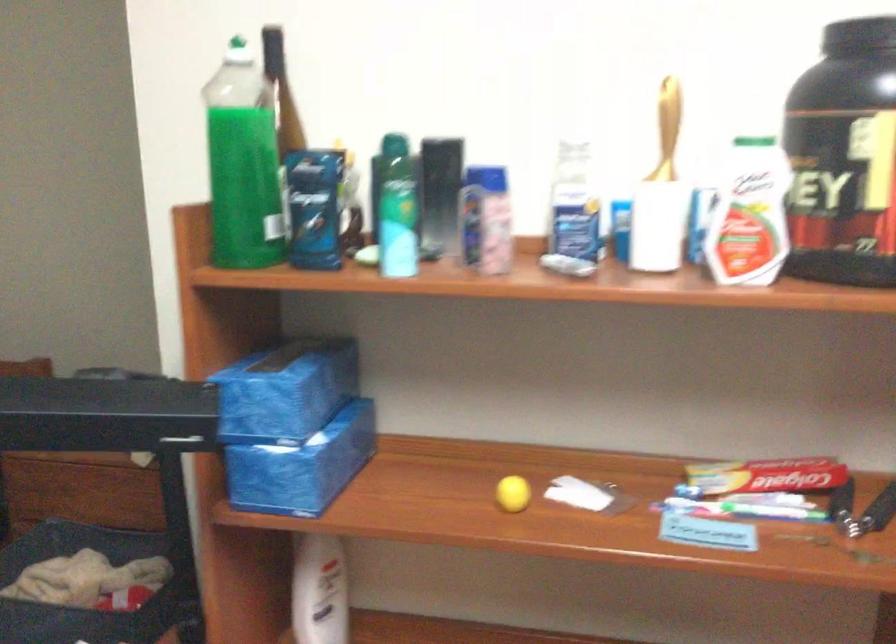
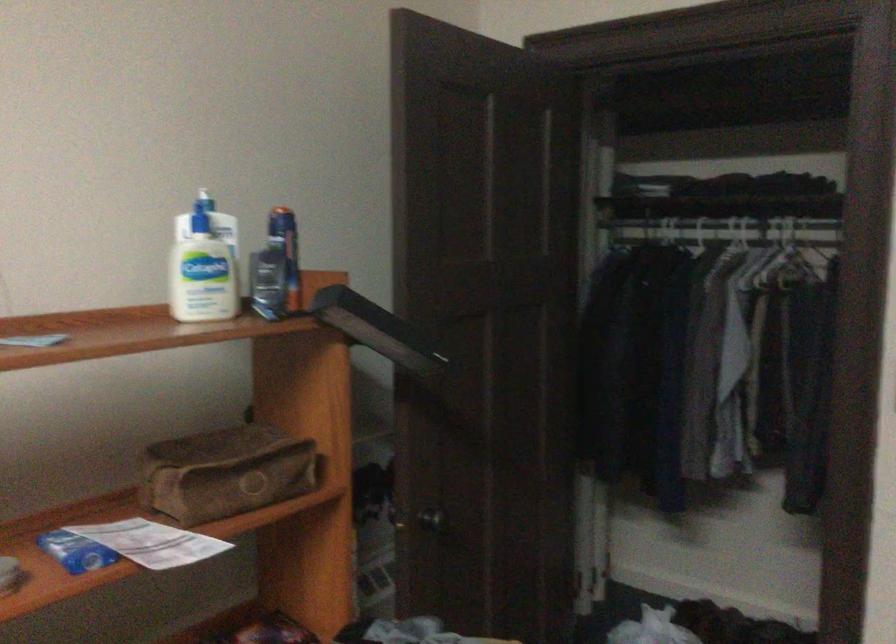
Question: The camera is either moving clockwise (left) or counter-clockwise (right) around the object. The first image is from the beginning of the video and the second image is from the end. Is the camera moving left or right when shooting the video?

Choices:
 (A) Left
 (B) Right

Answer: (B)